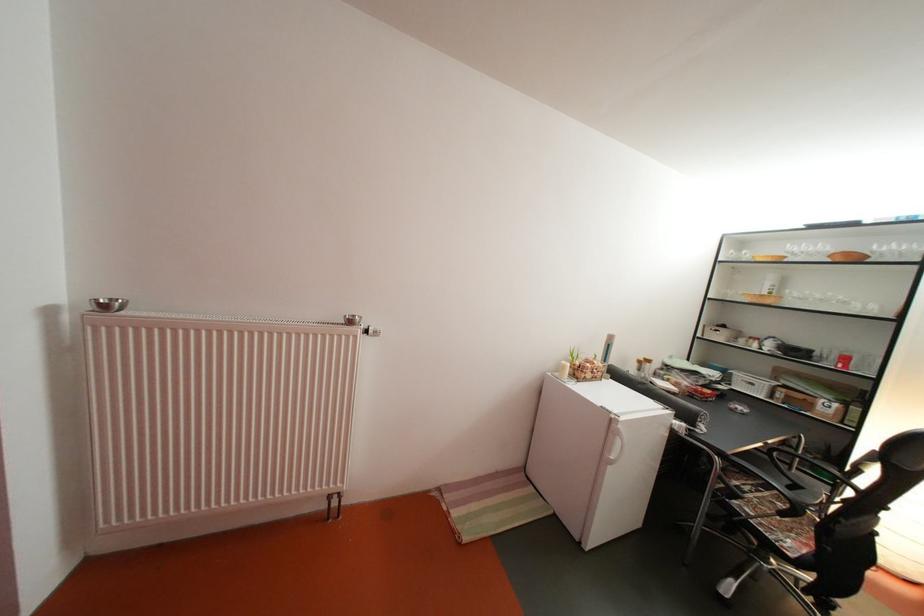
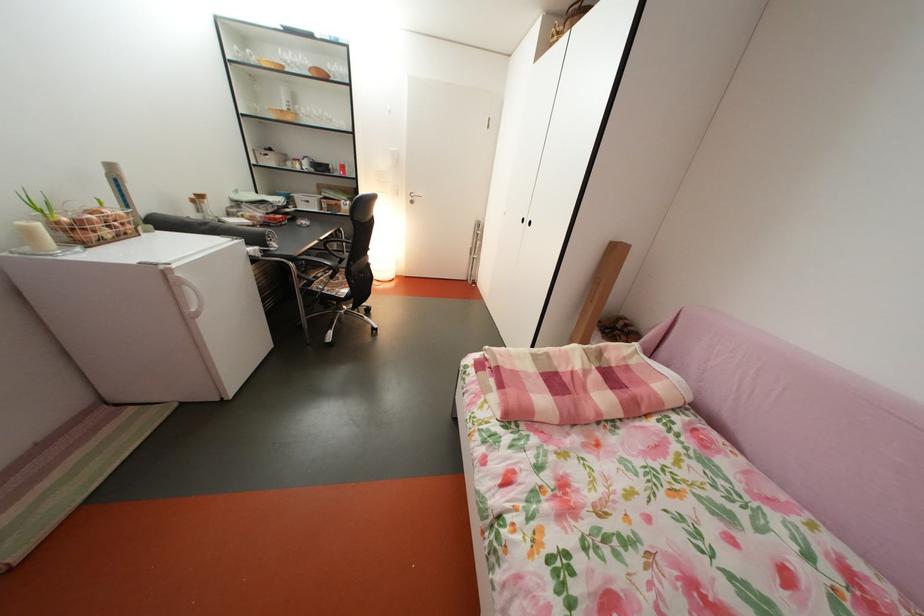
Where in the second image is the point corresponding to point 575,373 from the first image?

(41, 238)